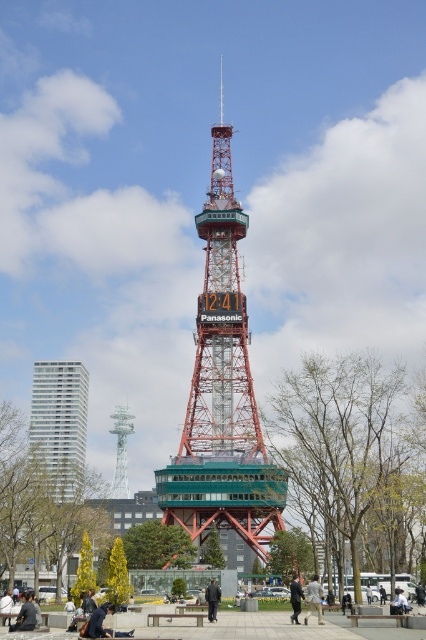
You are a photographer standing in the park and want to capture both the dark gray fabric jacket at center and the dark gray fabric jacket at lower center in a single photo. Which jacket should you focus on to ensure both are in frame without moving the camera?

You should focus on the dark gray fabric jacket at center because it is shorter than the dark gray fabric jacket at lower center, so keeping the shorter one centered increases the likelihood of both being in the frame.

You are a photographer standing in the park and want to take a photo of the red and green tower with the Panasonic logo. You notice a dark gray fabric jacket at center and a concrete bench at center. Where should you stand to ensure both the tower and the objects are in the frame?

You should stand to the right of the dark gray fabric jacket at center and concrete bench at center to include both the tower and the objects in your photo, as the jacket is on the left side of the bench.

You are standing in the park and want to take a photo of the tower. The camera you have can focus on objects up to 200 meters away. Is the point at coordinate point (86,401) within the camera focus range?

The point at coordinate point (86,401) is 180.04 meters from the viewer, which is within the camera focus range of up to 200 meters. Yes, the camera can focus on it.